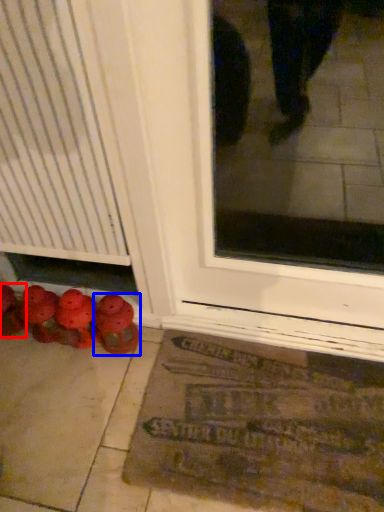
Question: Which object is closer to the camera taking this photo, footwear (highlighted by a red box) or footwear (highlighted by a blue box)?

Choices:
 (A) footwear
 (B) footwear

Answer: (B)